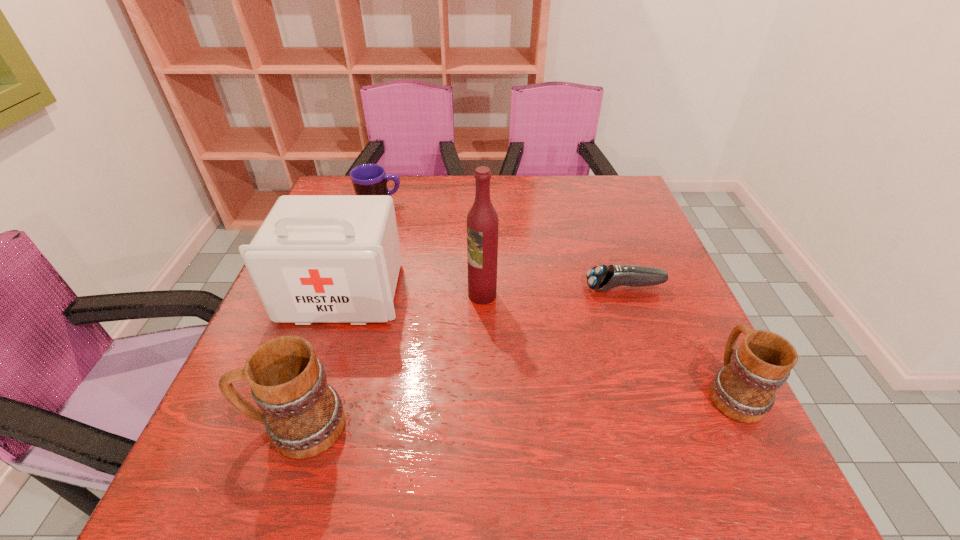
Where is `object that is the second closest to the shortest mug`? The image size is (960, 540). object that is the second closest to the shortest mug is located at coordinates (482, 221).

Point out which object is positioned as the fifth nearest to the farthest mug. Please provide its 2D coordinates. Your answer should be formatted as a tuple, i.e. [(x, y)], where the tuple contains the x and y coordinates of a point satisfying the conditions above.

[(744, 389)]

Identify which mug is located as the second nearest to the tallest object. Please provide its 2D coordinates. Your answer should be formatted as a tuple, i.e. [(x, y)], where the tuple contains the x and y coordinates of a point satisfying the conditions above.

[(368, 179)]

Identify which mug is the third closest to the first-aid kit. Please provide its 2D coordinates. Your answer should be formatted as a tuple, i.e. [(x, y)], where the tuple contains the x and y coordinates of a point satisfying the conditions above.

[(744, 389)]

The height and width of the screenshot is (540, 960). Identify the location of free space that satisfies the following two spatial constraints: 1. with the handle on the side of the farthest object; 2. on the side of the second shortest mug with the handle. (322, 390).

Locate an element on the screen. The width and height of the screenshot is (960, 540). vacant area that satisfies the following two spatial constraints: 1. with the handle on the side of the shortest mug; 2. on the side of the third shortest object with the handle is located at coordinates (322, 390).

The height and width of the screenshot is (540, 960). What are the coordinates of `vacant space that satisfies the following two spatial constraints: 1. with the handle on the side of the farthest object; 2. on the side of the second shortest mug with the handle` in the screenshot? It's located at (322, 390).